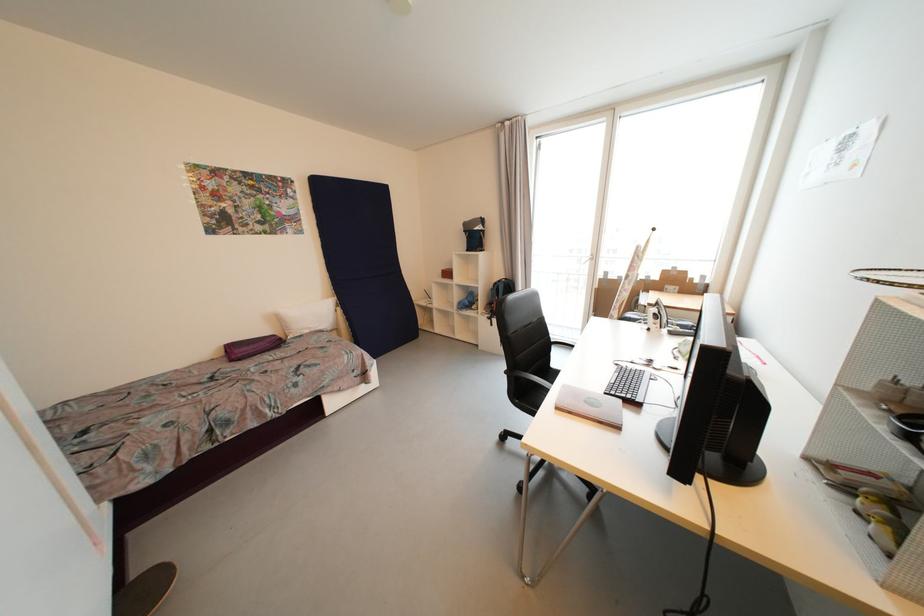
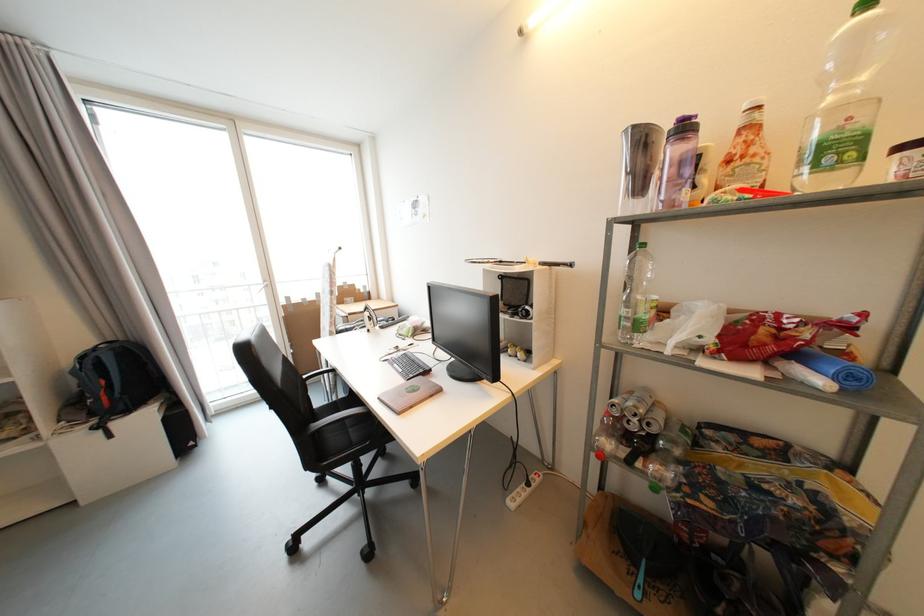
The point at (597, 257) is marked in the first image. Where is the corresponding point in the second image?

(271, 283)